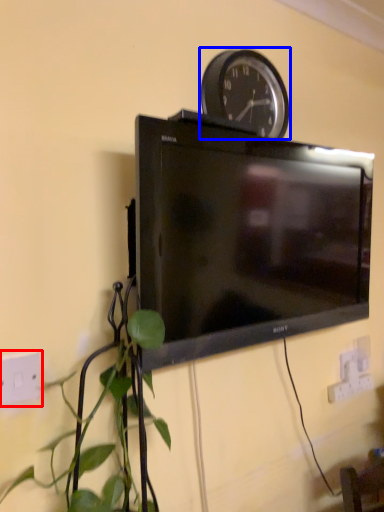
Question: Which of the following is the farthest to the observer, electric outlet (highlighted by a red box) or wall clock (highlighted by a blue box)?

Choices:
 (A) electric outlet
 (B) wall clock

Answer: (B)